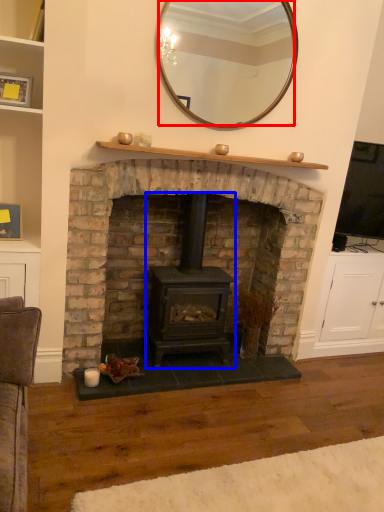
Question: Which object appears closest to the camera in this image, mirror (highlighted by a red box) or wood burning stove (highlighted by a blue box)?

Choices:
 (A) mirror
 (B) wood burning stove

Answer: (A)